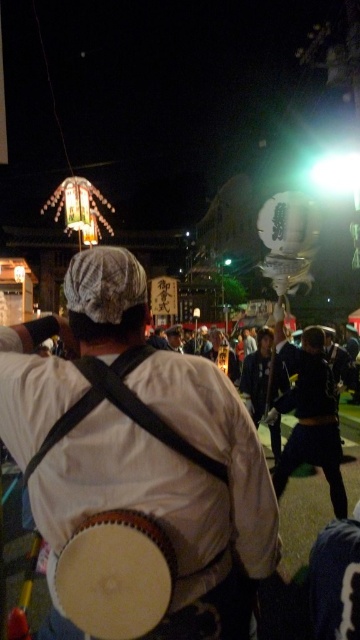
Question: Which of the following is the closest to the observer?

Choices:
 (A) (326, 404)
 (B) (267, 573)

Answer: (B)

Question: Is white fabric drum at center wider than dark blue fabric pants at lower right?

Choices:
 (A) no
 (B) yes

Answer: (B)

Question: Which object is closer to the camera taking this photo?

Choices:
 (A) white drum at center
 (B) white fabric drum at center

Answer: (A)

Question: Is white fabric drum at center to the left of dark blue fabric pants at lower right from the viewer's perspective?

Choices:
 (A) no
 (B) yes

Answer: (B)

Question: Which point is closer to the camera?

Choices:
 (A) dark blue fabric pants at lower right
 (B) white drum at center

Answer: (B)

Question: Does white fabric drum at center have a smaller size compared to white drum at center?

Choices:
 (A) yes
 (B) no

Answer: (B)